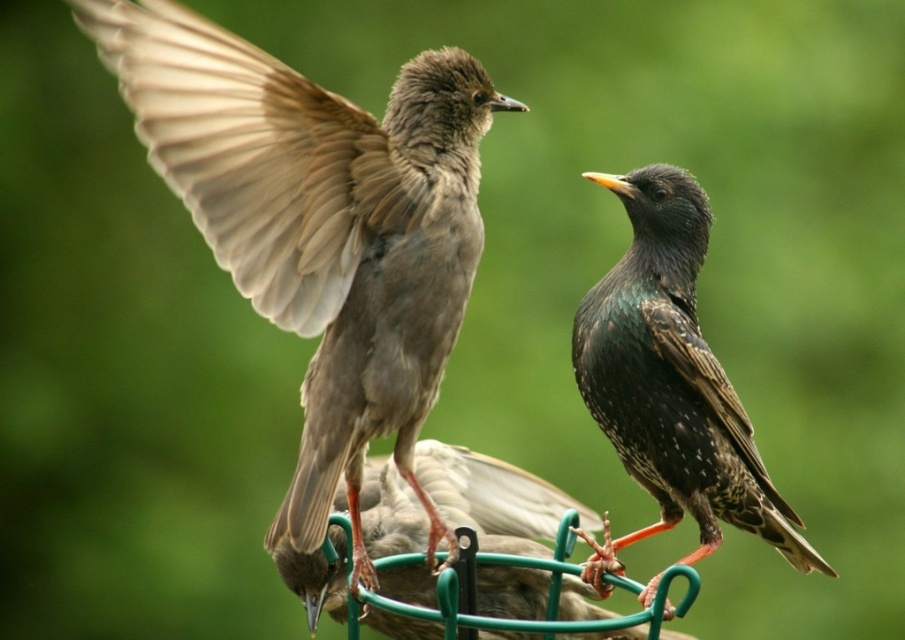
Question: Can you confirm if brown feathered bird at left is wider than shiny black bird at center?

Choices:
 (A) no
 (B) yes

Answer: (B)

Question: Which object appears farthest from the camera in this image?

Choices:
 (A) shiny black bird at center
 (B) brown feathered bird at left

Answer: (A)

Question: Which of the following is the farthest from the observer?

Choices:
 (A) shiny black bird at center
 (B) brown feathered bird at left

Answer: (A)

Question: Which of the following is the farthest from the observer?

Choices:
 (A) brown feathered bird at left
 (B) shiny black bird at center

Answer: (B)

Question: Is brown feathered bird at left positioned in front of shiny black bird at center?

Choices:
 (A) no
 (B) yes

Answer: (B)

Question: Is brown feathered bird at left to the right of shiny black bird at center from the viewer's perspective?

Choices:
 (A) no
 (B) yes

Answer: (A)